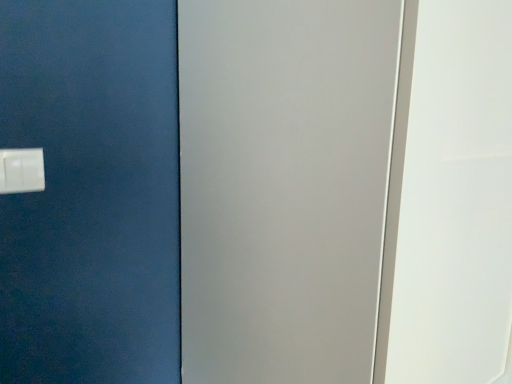
Question: Is satin white screen door at center facing away from white plastic light switch at lower left?

Choices:
 (A) yes
 (B) no

Answer: (B)

Question: Is satin white screen door at center at the left side of white plastic light switch at lower left?

Choices:
 (A) no
 (B) yes

Answer: (A)

Question: From the image's perspective, is satin white screen door at center under white plastic light switch at lower left?

Choices:
 (A) no
 (B) yes

Answer: (B)

Question: Does satin white screen door at center have a larger size compared to white plastic light switch at lower left?

Choices:
 (A) no
 (B) yes

Answer: (B)

Question: From a real-world perspective, is satin white screen door at center positioned under white plastic light switch at lower left based on gravity?

Choices:
 (A) no
 (B) yes

Answer: (B)

Question: Is satin white screen door at center to the right of white plastic light switch at lower left from the viewer's perspective?

Choices:
 (A) yes
 (B) no

Answer: (A)

Question: Considering the relative sizes of white plastic light switch at lower left and satin white screen door at center in the image provided, is white plastic light switch at lower left taller than satin white screen door at center?

Choices:
 (A) yes
 (B) no

Answer: (B)

Question: Considering the relative sizes of white plastic light switch at lower left and satin white screen door at center in the image provided, is white plastic light switch at lower left smaller than satin white screen door at center?

Choices:
 (A) yes
 (B) no

Answer: (A)

Question: Is white plastic light switch at lower left outside of satin white screen door at center?

Choices:
 (A) yes
 (B) no

Answer: (A)

Question: Would you say white plastic light switch at lower left is a long distance from satin white screen door at center?

Choices:
 (A) no
 (B) yes

Answer: (A)

Question: Does white plastic light switch at lower left lie in front of satin white screen door at center?

Choices:
 (A) no
 (B) yes

Answer: (A)

Question: From the image's perspective, is white plastic light switch at lower left located above satin white screen door at center?

Choices:
 (A) yes
 (B) no

Answer: (A)

Question: Is white plastic light switch at lower left to the left or to the right of satin white screen door at center in the image?

Choices:
 (A) left
 (B) right

Answer: (A)